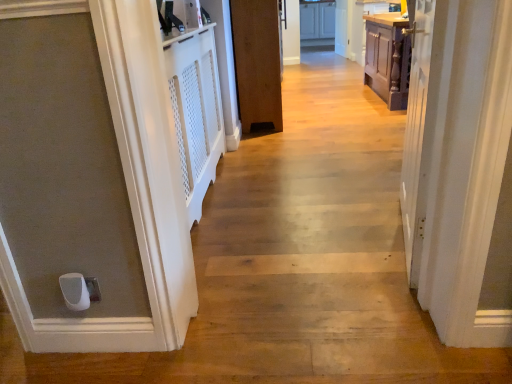
This screenshot has height=384, width=512. What do you see at coordinates (257, 62) in the screenshot?
I see `brown wood door at center` at bounding box center [257, 62].

I want to click on brown wood door at center, so click(257, 62).

You are a GUI agent. You are given a task and a screenshot of the screen. Output one action in this format:
    pyautogui.click(x=<x>, y=<y>)
    Task: Click on the white glossy cabinets at upper center
    
    Given the screenshot: What is the action you would take?
    pyautogui.click(x=317, y=20)

Image resolution: width=512 pixels, height=384 pixels. Describe the element at coordinates (317, 20) in the screenshot. I see `white glossy cabinets at upper center` at that location.

What is the approximate width of white glossy cabinets at upper center?

white glossy cabinets at upper center is 25.70 inches in width.

I want to click on brown wood door at center, so click(257, 62).

Is brown wood door at center to the left or to the right of white glossy cabinets at upper center in the image?

In the image, brown wood door at center appears on the left side of white glossy cabinets at upper center.

Considering their positions, is brown wood door at center located in front of or behind white glossy cabinets at upper center?

brown wood door at center is in front of white glossy cabinets at upper center.

Which is behind, point (251, 64) or point (305, 6)?

The point (305, 6) is farther from the camera.

From the image's perspective, which one is positioned lower, brown wood door at center or white glossy cabinets at upper center?

brown wood door at center appears lower in the image.

From a real-world perspective, is brown wood door at center physically located above or below white glossy cabinets at upper center?

From a real-world perspective, brown wood door at center is physically above white glossy cabinets at upper center.

In the scene shown: Which of these two, brown wood door at center or white glossy cabinets at upper center, is thinner?

Thinner between the two is brown wood door at center.

Considering the relative sizes of brown wood door at center and white glossy cabinets at upper center in the image provided, is brown wood door at center taller than white glossy cabinets at upper center?

Correct, brown wood door at center is much taller as white glossy cabinets at upper center.

Does brown wood door at center have a larger size compared to white glossy cabinets at upper center?

Indeed, brown wood door at center has a larger size compared to white glossy cabinets at upper center.

In the scene shown: Is white glossy cabinets at upper center inside brown wood door at center?

No.

Would you consider brown wood door at center to be distant from white glossy cabinets at upper center?

Absolutely, brown wood door at center is distant from white glossy cabinets at upper center.

Is brown wood door at center facing towards white glossy cabinets at upper center?

No, brown wood door at center does not turn towards white glossy cabinets at upper center.

How different are the orientations of brown wood door at center and white glossy cabinets at upper center in degrees?

brown wood door at center and white glossy cabinets at upper center are facing 99.9 degrees away from each other.

Find the location of a particular element. door that is on the left side of white glossy cabinets at upper center is located at coordinates (257, 62).

Looking at this image, can you confirm if white glossy cabinets at upper center is positioned to the right of brown wood door at center?

Yes.

Does white glossy cabinets at upper center lie behind brown wood door at center?

Yes, white glossy cabinets at upper center is further from the camera.

Which is closer to the camera, (324, 30) or (269, 54)?

The point (269, 54) is more forward.

From the image's perspective, is white glossy cabinets at upper center over brown wood door at center?

Correct, white glossy cabinets at upper center appears higher than brown wood door at center in the image.

From a real-world perspective, which is physically above, white glossy cabinets at upper center or brown wood door at center?

brown wood door at center is physically above.

In terms of width, does white glossy cabinets at upper center look wider or thinner when compared to brown wood door at center?

Considering their sizes, white glossy cabinets at upper center looks broader than brown wood door at center.

In terms of height, does white glossy cabinets at upper center look taller or shorter compared to brown wood door at center?

In the image, white glossy cabinets at upper center appears to be shorter than brown wood door at center.

Looking at this image, based on their sizes in the image, would you say white glossy cabinets at upper center is bigger or smaller than brown wood door at center?

Considering their sizes, white glossy cabinets at upper center takes up less space than brown wood door at center.

Is white glossy cabinets at upper center not inside brown wood door at center?

Yes.

Is white glossy cabinets at upper center far away from brown wood door at center?

Yes, white glossy cabinets at upper center is far from brown wood door at center.

Is brown wood door at center at the back of white glossy cabinets at upper center?

white glossy cabinets at upper center is not turned away from brown wood door at center.

How many degrees apart are the facing directions of white glossy cabinets at upper center and brown wood door at center?

The angle between the facing direction of white glossy cabinets at upper center and the facing direction of brown wood door at center is 99.9 degrees.

In the image, there is a brown wood door at center. In order to click on cabinetry above it (from the image's perspective) in this screenshot , I will do `click(317, 20)`.

This screenshot has height=384, width=512. In order to click on cabinetry above the brown wood door at center (from the image's perspective) in this screenshot , I will do `click(317, 20)`.

Where is `door lying in front of the white glossy cabinets at upper center`? Image resolution: width=512 pixels, height=384 pixels. door lying in front of the white glossy cabinets at upper center is located at coordinates (257, 62).